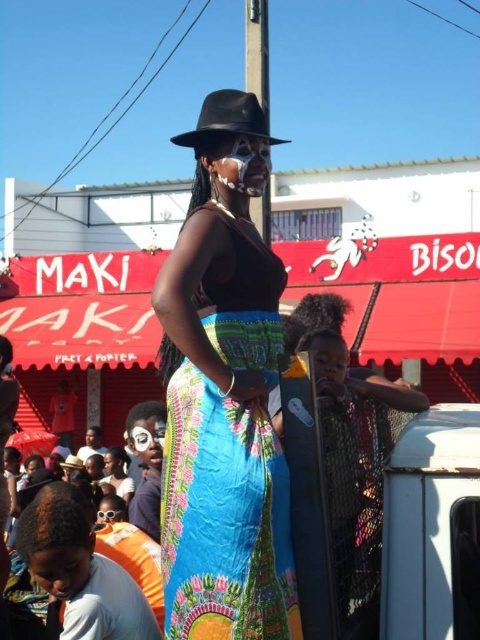
Question: Among these points, which one is farthest from the camera?

Choices:
 (A) (216, 118)
 (B) (213, 104)

Answer: (B)

Question: Which of the following is the farthest from the observer?

Choices:
 (A) (204, 134)
 (B) (244, 204)

Answer: (B)

Question: Is the position of matte black hat at center less distant than that of black felt fedora at upper center?

Choices:
 (A) no
 (B) yes

Answer: (B)

Question: Which point is farther from the camera taking this photo?

Choices:
 (A) (229, 93)
 (B) (255, 120)

Answer: (A)

Question: In this image, where is matte black hat at center located relative to black felt fedora at upper center?

Choices:
 (A) below
 (B) above

Answer: (A)

Question: Observing the image, what is the correct spatial positioning of matte black hat at center in reference to black felt fedora at upper center?

Choices:
 (A) above
 (B) below

Answer: (B)